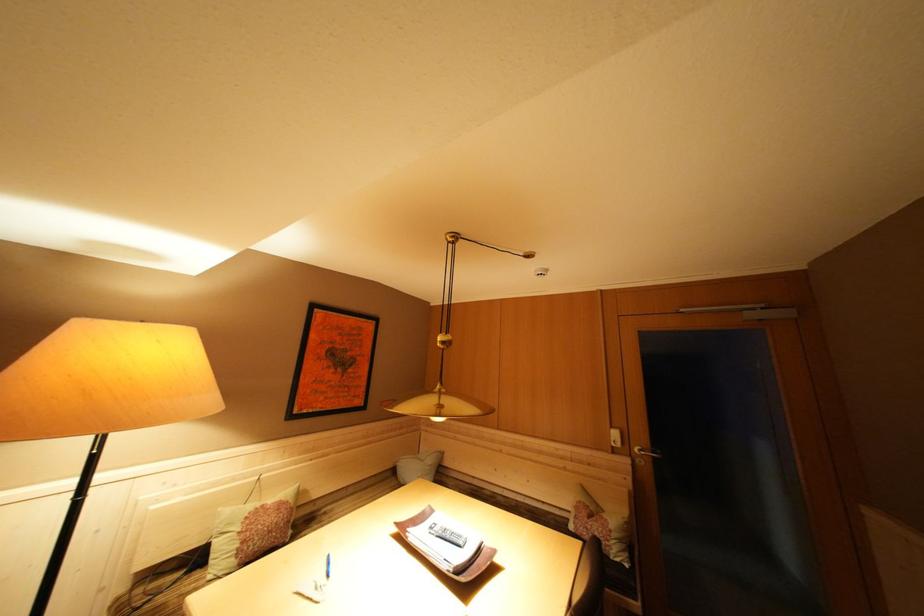
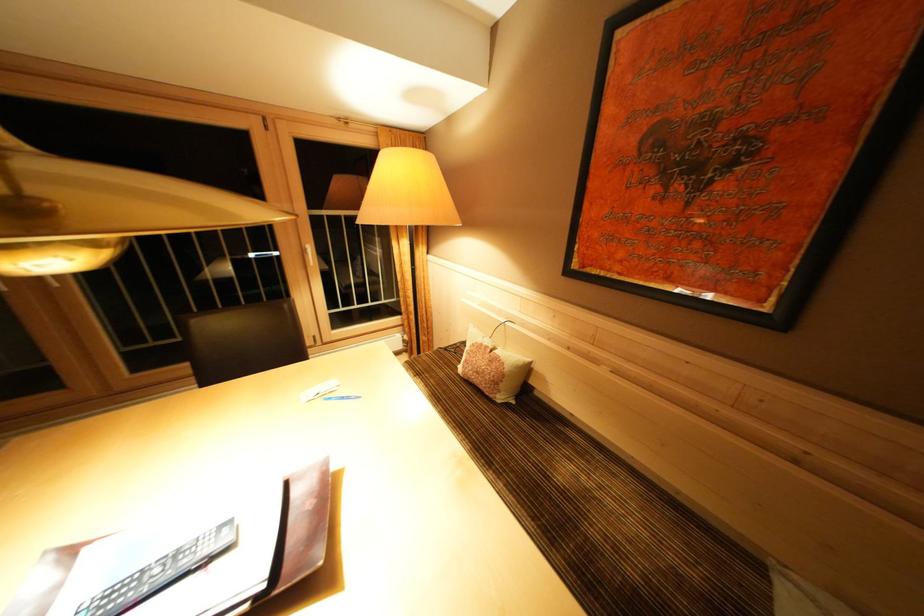
Find the pixel in the second image that matches pixel 271 511 in the first image.

(493, 352)